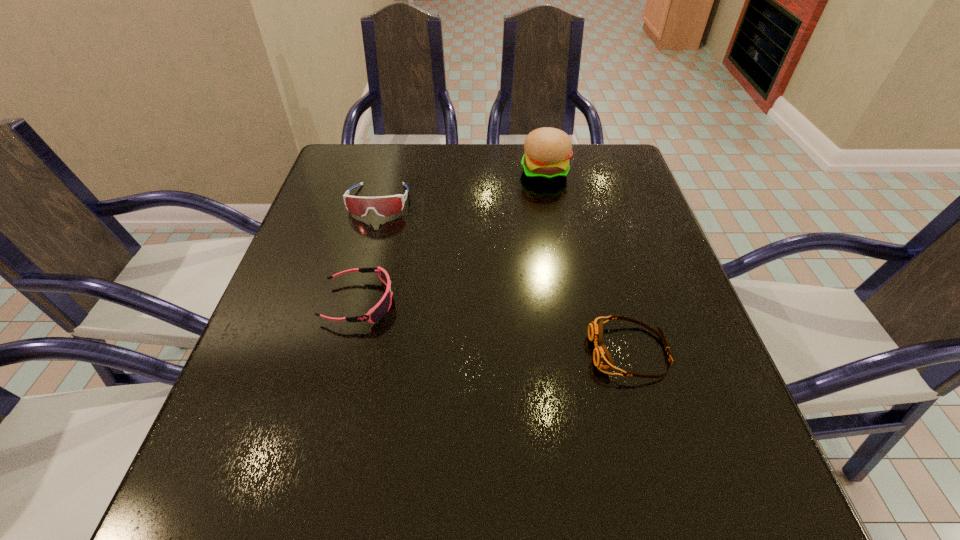
At what (x,y) coordinates should I click in order to perform the action: click on goggles that is at the far edge. Please return your answer as a coordinate pair (x, y). The width and height of the screenshot is (960, 540). Looking at the image, I should click on (384, 206).

Where is `object that is at the right edge`? Image resolution: width=960 pixels, height=540 pixels. object that is at the right edge is located at coordinates (602, 359).

Identify the location of object at the far left corner. (384, 206).

The image size is (960, 540). I want to click on vacant space at the far edge, so click(469, 152).

You are a GUI agent. You are given a task and a screenshot of the screen. Output one action in this format:
    pyautogui.click(x=<x>, y=<y>)
    Task: Click on the vacant space at the near edge of the desktop
    The height and width of the screenshot is (540, 960).
    Given the screenshot: What is the action you would take?
    pyautogui.click(x=315, y=476)

Locate an element on the screen. Image resolution: width=960 pixels, height=540 pixels. free space at the left edge of the desktop is located at coordinates (337, 311).

In the image, there is a desktop. Where is `free space at the right edge`? This screenshot has width=960, height=540. free space at the right edge is located at coordinates (630, 310).

What are the coordinates of `vacant space at the far left corner of the desktop` in the screenshot? It's located at (353, 169).

Where is `free region at the far right corner of the desktop`? This screenshot has height=540, width=960. free region at the far right corner of the desktop is located at coordinates (619, 143).

Where is `vacant space that's between the rightmost goggles and the tallest object`? vacant space that's between the rightmost goggles and the tallest object is located at coordinates (588, 262).